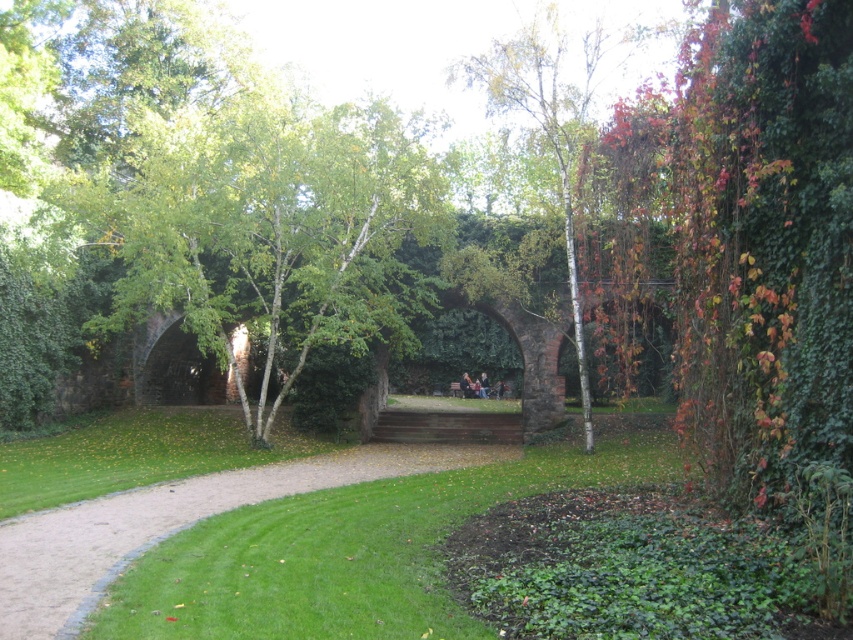
You are planning to install a small garden bench in the park. The bench requires at least 30 feet of space between the green leafy tree at center and the green grass at center to ensure proper growth of the grass. Based on the scene, is the current distance sufficient?

The green leafy tree at center and green grass at center are 29.23 feet apart, which is less than the required 30 feet. Therefore, the current distance is insufficient for the bench installation to ensure proper grass growth.

Consider the image. You are planning to set up a picnic blanket in the park. The green leafy tree at center and the white bark tree at center are both in your view. Which tree should you choose to place your blanket under to have more shade?

The green leafy tree at center is wider than the white bark tree at center, so it would provide more shade for your picnic blanket.